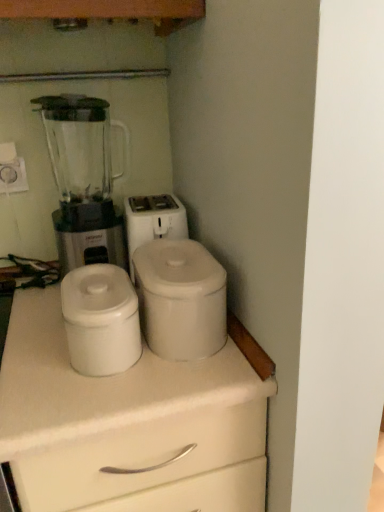
In the scene shown: What is the approximate width of transparent plastic blender at left?

It is 19.36 centimeters.

The width and height of the screenshot is (384, 512). What do you see at coordinates (82, 180) in the screenshot?
I see `transparent plastic blender at left` at bounding box center [82, 180].

Where is `white matte container at center, which is the second appliance from right to left`? The width and height of the screenshot is (384, 512). white matte container at center, which is the second appliance from right to left is located at coordinates (101, 320).

Is white matte container at center, which is the second appliance from right to left, surrounded by transparent plastic blender at left?

No, white matte container at center, which is the second appliance from right to left, is located outside of transparent plastic blender at left.

Which of these two, transparent plastic blender at left or white matte container at center, which is the second appliance from right to left, is wider?

transparent plastic blender at left.

Is transparent plastic blender at left at the left side of white matte container at center, which is the first appliance from left to right?

Correct, you'll find transparent plastic blender at left to the left of white matte container at center, which is the first appliance from left to right.

In the scene shown: Is white matte container at center, which is the first appliance from left to right, taller or shorter than transparent plastic blender at left?

white matte container at center, which is the first appliance from left to right, is shorter than transparent plastic blender at left.

From the transparent plastic blender at left, count 1st appliance to the right and point to it. Please provide its 2D coordinates.

[(101, 320)]

Which is more to the left, white matte container at center, which is the first appliance from left to right, or transparent plastic blender at left?

transparent plastic blender at left.

In the scene shown: Measure the distance between white matte container at center, which is the second appliance from right to left, and transparent plastic blender at left.

white matte container at center, which is the second appliance from right to left, and transparent plastic blender at left are 9.96 inches apart from each other.

Considering the relative sizes of white matte chest of drawers at center and transparent plastic blender at left in the image provided, is white matte chest of drawers at center thinner than transparent plastic blender at left?

In fact, white matte chest of drawers at center might be wider than transparent plastic blender at left.

Does white matte chest of drawers at center turn towards transparent plastic blender at left?

No, white matte chest of drawers at center is not oriented towards transparent plastic blender at left.

Is white matte chest of drawers at center surrounding transparent plastic blender at left?

No, transparent plastic blender at left is not a part of white matte chest of drawers at center.

In terms of height, does white matte chest of drawers at center look taller or shorter compared to transparent plastic blender at left?

In the image, white matte chest of drawers at center appears to be taller than transparent plastic blender at left.

Is white matte chest of drawers at center inside or outside of white matte container at center, which is the first appliance from left to right?

white matte chest of drawers at center is located beyond the bounds of white matte container at center, which is the first appliance from left to right.

Based on the photo, is white matte chest of drawers at center wider or thinner than white matte container at center, which is the first appliance from left to right?

In the image, white matte chest of drawers at center appears to be wider than white matte container at center, which is the first appliance from left to right.

Considering the relative positions of white matte chest of drawers at center and white matte container at center, which is the first appliance from left to right, in the image provided, is white matte chest of drawers at center to the left of white matte container at center, which is the first appliance from left to right, from the viewer's perspective?

Correct, you'll find white matte chest of drawers at center to the left of white matte container at center, which is the first appliance from left to right.

Is white matte chest of drawers at center far away from white matte container at center, which is the second appliance from right to left?

Actually, white matte chest of drawers at center and white matte container at center, which is the second appliance from right to left, are a little close together.

From the picture: Measure the distance from white matte canister at center, positioned as the 2th appliance in left-to-right order, to white matte container at center, which is the first appliance from left to right.

A distance of 3.29 inches exists between white matte canister at center, positioned as the 2th appliance in left-to-right order, and white matte container at center, which is the first appliance from left to right.

Which object is thinner, white matte canister at center, arranged as the 1th appliance when viewed from the right, or white matte container at center, which is the second appliance from right to left?

white matte container at center, which is the second appliance from right to left.

The width and height of the screenshot is (384, 512). Identify the location of appliance located on the left of white matte canister at center, arranged as the 1th appliance when viewed from the right. (101, 320).

Choose the correct answer: Is white matte canister at center, arranged as the 1th appliance when viewed from the right, inside white matte container at center, which is the second appliance from right to left, or outside it?

white matte canister at center, arranged as the 1th appliance when viewed from the right, is not enclosed by white matte container at center, which is the second appliance from right to left.

Relative to white matte chest of drawers at center, is transparent plastic blender at left in front or behind?

transparent plastic blender at left is behind white matte chest of drawers at center.

Is transparent plastic blender at left oriented away from white matte chest of drawers at center?

transparent plastic blender at left does not have its back to white matte chest of drawers at center.

Which of these two, transparent plastic blender at left or white matte chest of drawers at center, stands shorter?

transparent plastic blender at left.

Which object is thinner, transparent plastic blender at left or white matte chest of drawers at center?

With smaller width is transparent plastic blender at left.

From a real-world perspective, is white matte canister at center, arranged as the 1th appliance when viewed from the right, physically above transparent plastic blender at left?

No, from a real-world perspective, white matte canister at center, arranged as the 1th appliance when viewed from the right, is not above transparent plastic blender at left.

Can you tell me how much white matte canister at center, arranged as the 1th appliance when viewed from the right, and transparent plastic blender at left differ in facing direction?

The angle between the facing direction of white matte canister at center, arranged as the 1th appliance when viewed from the right, and the facing direction of transparent plastic blender at left is 0.000484 degrees.

Are white matte canister at center, positioned as the 2th appliance in left-to-right order, and transparent plastic blender at left making contact?

No, white matte canister at center, positioned as the 2th appliance in left-to-right order, is not in contact with transparent plastic blender at left.

Which is correct: white matte canister at center, positioned as the 2th appliance in left-to-right order, is inside transparent plastic blender at left, or outside of it?

The correct answer is: outside.

Where is `blender above the white matte container at center, which is the second appliance from right to left (from the image's perspective)`? blender above the white matte container at center, which is the second appliance from right to left (from the image's perspective) is located at coordinates (82, 180).

Where is `the 2nd appliance in front of the transparent plastic blender at left, starting your count from the anchor`? The image size is (384, 512). the 2nd appliance in front of the transparent plastic blender at left, starting your count from the anchor is located at coordinates (101, 320).

When comparing their distances from white matte chest of drawers at center, does transparent plastic blender at left or white matte canister at center, arranged as the 1th appliance when viewed from the right, seem further?

Based on the image, transparent plastic blender at left appears to be further to white matte chest of drawers at center.

When comparing their distances from transparent plastic blender at left, does white matte chest of drawers at center or white matte container at center, which is the first appliance from left to right, seem closer?

white matte container at center, which is the first appliance from left to right, lies closer to transparent plastic blender at left than the other object.

Estimate the real-world distances between objects in this image. Which object is further from white matte container at center, which is the second appliance from right to left, transparent plastic blender at left or white matte canister at center, arranged as the 1th appliance when viewed from the right?

Among the two, transparent plastic blender at left is located further to white matte container at center, which is the second appliance from right to left.

Which object lies nearer to the anchor point white matte container at center, which is the second appliance from right to left, white matte chest of drawers at center or white matte canister at center, positioned as the 2th appliance in left-to-right order?

Among the two, white matte canister at center, positioned as the 2th appliance in left-to-right order, is located nearer to white matte container at center, which is the second appliance from right to left.

Considering their positions, is transparent plastic blender at left positioned further to white matte container at center, which is the second appliance from right to left, than white matte chest of drawers at center?

Among the two, transparent plastic blender at left is located further to white matte container at center, which is the second appliance from right to left.

Looking at the image, which one is located closer to white matte container at center, which is the second appliance from right to left, white matte canister at center, arranged as the 1th appliance when viewed from the right, or white matte chest of drawers at center?

white matte canister at center, arranged as the 1th appliance when viewed from the right, lies closer to white matte container at center, which is the second appliance from right to left, than the other object.

Looking at the image, which one is located further to white matte container at center, which is the second appliance from right to left, white matte canister at center, positioned as the 2th appliance in left-to-right order, or transparent plastic blender at left?

transparent plastic blender at left is further to white matte container at center, which is the second appliance from right to left.

Which object lies nearer to the anchor point white matte chest of drawers at center, white matte canister at center, positioned as the 2th appliance in left-to-right order, or white matte container at center, which is the second appliance from right to left?

Based on the image, white matte container at center, which is the second appliance from right to left, appears to be nearer to white matte chest of drawers at center.

Identify the location of appliance between transparent plastic blender at left and white matte canister at center, positioned as the 2th appliance in left-to-right order, in the horizontal direction. Image resolution: width=384 pixels, height=512 pixels. (101, 320).

Locate an element on the screen. appliance that lies between white matte canister at center, positioned as the 2th appliance in left-to-right order, and white matte chest of drawers at center from top to bottom is located at coordinates (101, 320).